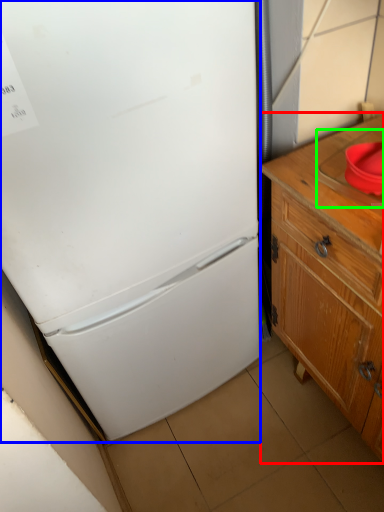
Question: Which object is the farthest from cabinetry (highlighted by a red box)? Choose among these: refrigerator (highlighted by a blue box) or sink (highlighted by a green box).

Choices:
 (A) refrigerator
 (B) sink

Answer: (A)